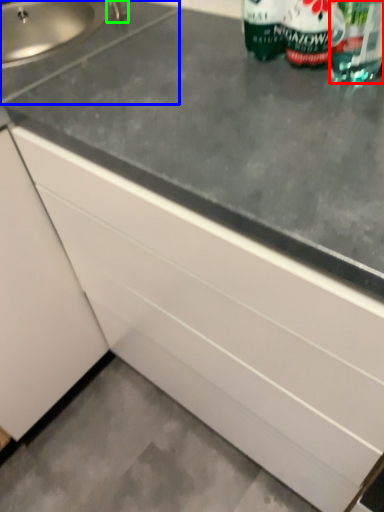
Question: Which object is the farthest from drinking straw (highlighted by a red box)? Choose among these: sink (highlighted by a blue box) or faucet (highlighted by a green box).

Choices:
 (A) sink
 (B) faucet

Answer: (B)